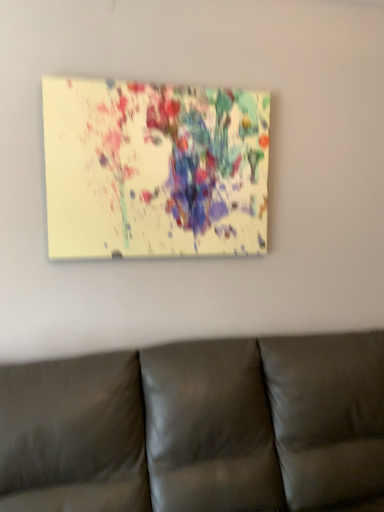
Question: From a real-world perspective, is leather couch at lower center below matte acrylic painting at upper center?

Choices:
 (A) no
 (B) yes

Answer: (B)

Question: Considering the relative positions of leather couch at lower center and matte acrylic painting at upper center in the image provided, is leather couch at lower center to the right of matte acrylic painting at upper center from the viewer's perspective?

Choices:
 (A) no
 (B) yes

Answer: (B)

Question: Is leather couch at lower center bigger than matte acrylic painting at upper center?

Choices:
 (A) no
 (B) yes

Answer: (B)

Question: From the image's perspective, would you say leather couch at lower center is shown under matte acrylic painting at upper center?

Choices:
 (A) yes
 (B) no

Answer: (A)

Question: Is leather couch at lower center at the left side of matte acrylic painting at upper center?

Choices:
 (A) yes
 (B) no

Answer: (B)

Question: Considering the relative sizes of leather couch at lower center and matte acrylic painting at upper center in the image provided, is leather couch at lower center shorter than matte acrylic painting at upper center?

Choices:
 (A) yes
 (B) no

Answer: (B)

Question: Is matte acrylic painting at upper center looking in the opposite direction of leather couch at lower center?

Choices:
 (A) no
 (B) yes

Answer: (A)

Question: Is matte acrylic painting at upper center outside leather couch at lower center?

Choices:
 (A) yes
 (B) no

Answer: (A)

Question: Can you confirm if matte acrylic painting at upper center is taller than leather couch at lower center?

Choices:
 (A) no
 (B) yes

Answer: (A)

Question: From a real-world perspective, is matte acrylic painting at upper center on leather couch at lower center?

Choices:
 (A) yes
 (B) no

Answer: (A)

Question: Could leather couch at lower center be considered to be inside matte acrylic painting at upper center?

Choices:
 (A) no
 (B) yes

Answer: (A)

Question: Is matte acrylic painting at upper center wider than leather couch at lower center?

Choices:
 (A) no
 (B) yes

Answer: (A)

Question: Is point (110, 210) closer or farther from the camera than point (380, 384)?

Choices:
 (A) farther
 (B) closer

Answer: (B)